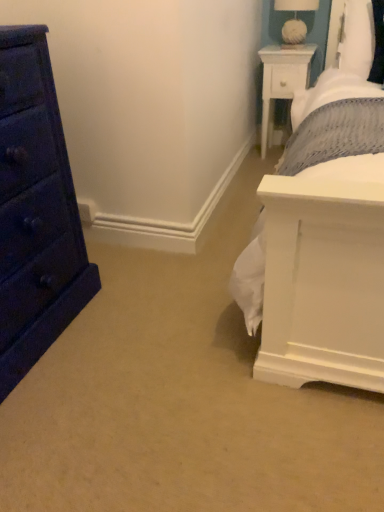
Question: Is matte dark blue dresser at left looking in the opposite direction of white wood nightstand at upper right?

Choices:
 (A) yes
 (B) no

Answer: (B)

Question: Is matte dark blue dresser at left with white wood nightstand at upper right?

Choices:
 (A) yes
 (B) no

Answer: (B)

Question: Is matte dark blue dresser at left wider than white wood nightstand at upper right?

Choices:
 (A) yes
 (B) no

Answer: (A)

Question: Considering the relative positions of matte dark blue dresser at left and white wood nightstand at upper right in the image provided, is matte dark blue dresser at left to the left of white wood nightstand at upper right from the viewer's perspective?

Choices:
 (A) yes
 (B) no

Answer: (A)

Question: Would you consider matte dark blue dresser at left to be distant from white wood nightstand at upper right?

Choices:
 (A) no
 (B) yes

Answer: (B)

Question: From a real-world perspective, does matte dark blue dresser at left stand above white wood nightstand at upper right?

Choices:
 (A) no
 (B) yes

Answer: (B)

Question: Is matte dark blue dresser at left positioned behind white fabric-covered lampshade at upper right?

Choices:
 (A) yes
 (B) no

Answer: (B)

Question: From a real-world perspective, is matte dark blue dresser at left physically above white fabric-covered lampshade at upper right?

Choices:
 (A) yes
 (B) no

Answer: (B)

Question: Can you confirm if matte dark blue dresser at left is wider than white fabric-covered lampshade at upper right?

Choices:
 (A) yes
 (B) no

Answer: (A)

Question: Considering the relative sizes of matte dark blue dresser at left and white fabric-covered lampshade at upper right in the image provided, is matte dark blue dresser at left shorter than white fabric-covered lampshade at upper right?

Choices:
 (A) yes
 (B) no

Answer: (B)

Question: From the image's perspective, is matte dark blue dresser at left located beneath white fabric-covered lampshade at upper right?

Choices:
 (A) no
 (B) yes

Answer: (B)

Question: Is matte dark blue dresser at left positioned in front of white fabric-covered lampshade at upper right?

Choices:
 (A) yes
 (B) no

Answer: (A)

Question: Considering the relative positions of white wood nightstand at upper right and matte dark blue dresser at left in the image provided, is white wood nightstand at upper right to the right of matte dark blue dresser at left from the viewer's perspective?

Choices:
 (A) no
 (B) yes

Answer: (B)